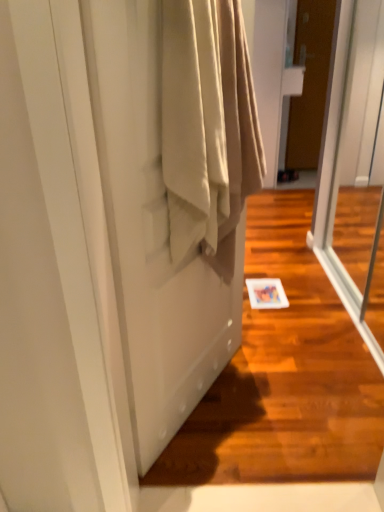
At what (x,y) coordinates should I click in order to perform the action: click on free region under satin beige curtain at lower left, arranged as the 2th screen door when viewed from the right (from a real-world perspective). Please return your answer as a coordinate pair (x, y). The image size is (384, 512). Looking at the image, I should click on (206, 399).